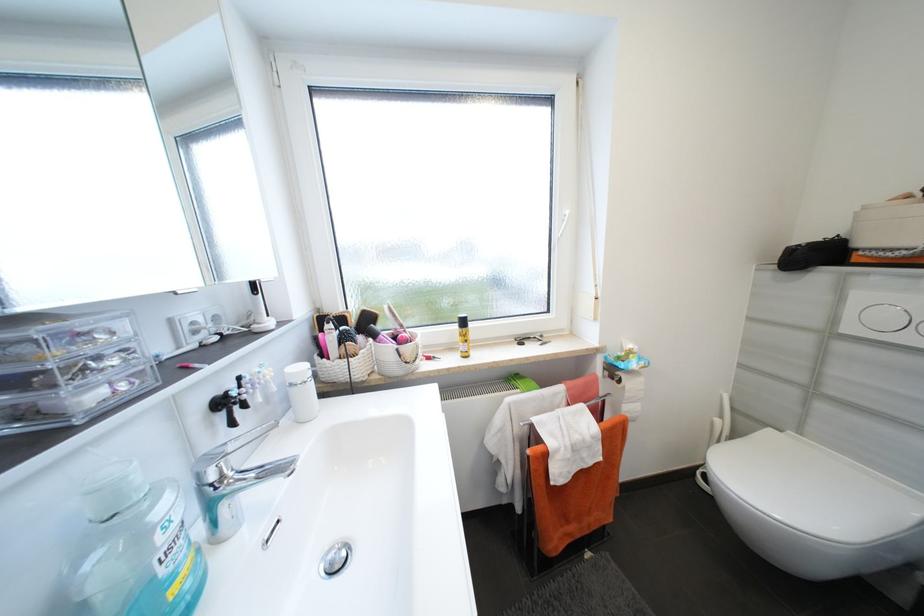
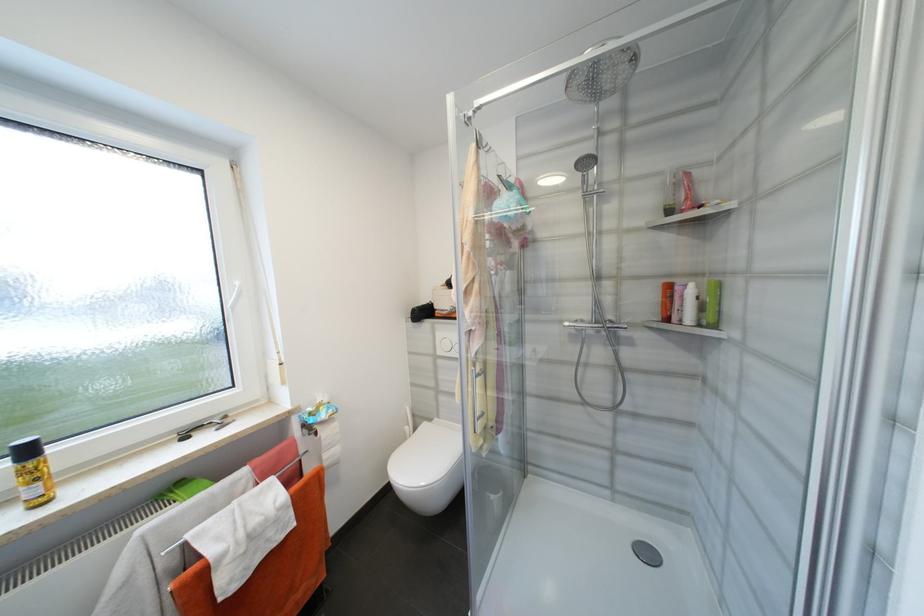
The point at (855, 330) is marked in the first image. Where is the corresponding point in the second image?

(445, 353)